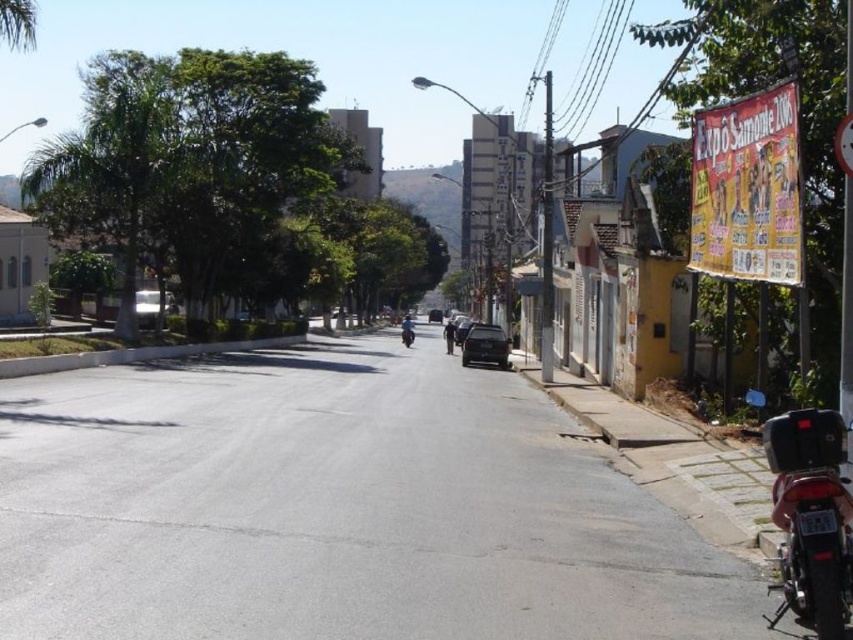
You are a delivery person who needs to park your vehicle in the parking lot behind the buildings on the right. You have a shiny black motorcycle at lower right and a matte black car at center. Which vehicle will require less space to park?

The shiny black motorcycle at lower right is smaller than the matte black car at center, so it requires less space to park.

You are a delivery person needing to park your 1.8 meters tall delivery box. You see a metallic silver car at left and a blue matte motorcycle at center. Which vehicle is shorter so you can safely place your box next to it without blocking the road?

The metallic silver car at left has a lesser height compared to the blue matte motorcycle at center, so you can safely place the delivery box next to the metallic silver car at left without blocking the road.